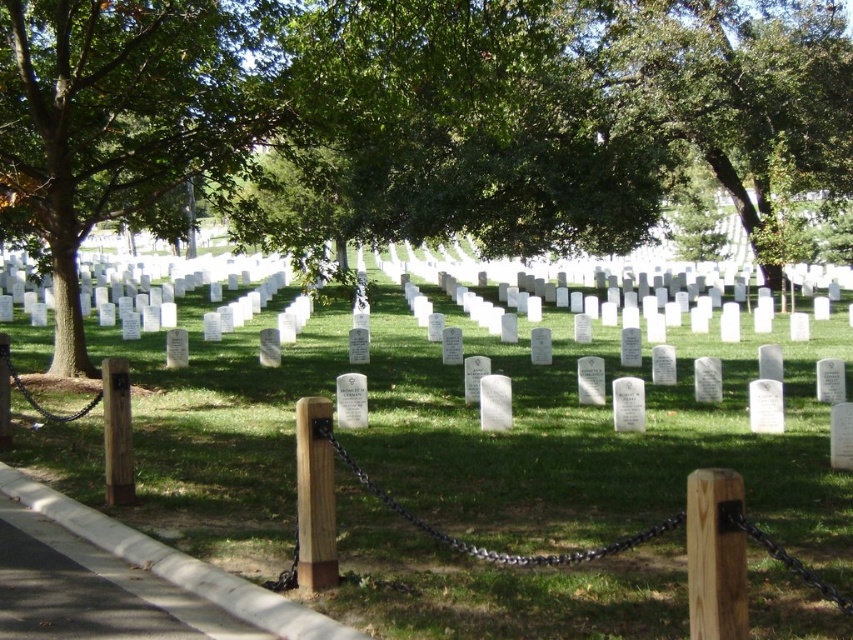
Does green grass at center have a greater height compared to green leafy tree at upper center?

In fact, green grass at center may be shorter than green leafy tree at upper center.

Is green grass at center smaller than green leafy tree at upper center?

Indeed, green grass at center has a smaller size compared to green leafy tree at upper center.

Measure the distance between green grass at center and camera.

green grass at center and camera are 15.80 feet apart from each other.

This screenshot has height=640, width=853. I want to click on green grass at center, so click(x=471, y=435).

Is point (582, 76) farther from viewer compared to point (653, 396)?

Yes, it is behind point (653, 396).

Is green leafy tree at center smaller than green grass at center?

No, green leafy tree at center is not smaller than green grass at center.

This screenshot has width=853, height=640. Find the location of `green leafy tree at center`. green leafy tree at center is located at coordinates (410, 116).

In order to click on green leafy tree at center in this screenshot , I will do `click(410, 116)`.

What do you see at coordinates (410, 116) in the screenshot? The image size is (853, 640). I see `green leafy tree at center` at bounding box center [410, 116].

Is green leafy tree at center taller than green leafy tree at upper center?

Correct, green leafy tree at center is much taller as green leafy tree at upper center.

Between point (461, 193) and point (708, 74), which one is positioned behind?

The point (708, 74) is more distant.

What are the coordinates of `green leafy tree at center` in the screenshot? It's located at (410, 116).